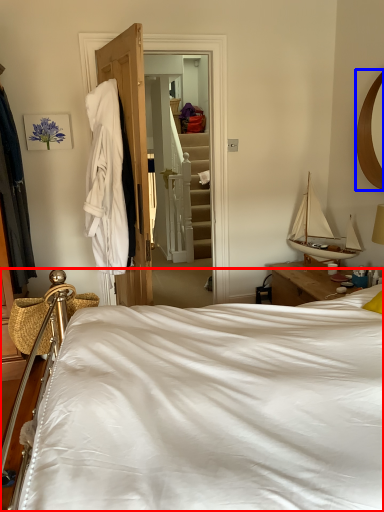
Question: Which of the following is the closest to the observer, bed (highlighted by a red box) or mirror (highlighted by a blue box)?

Choices:
 (A) bed
 (B) mirror

Answer: (A)